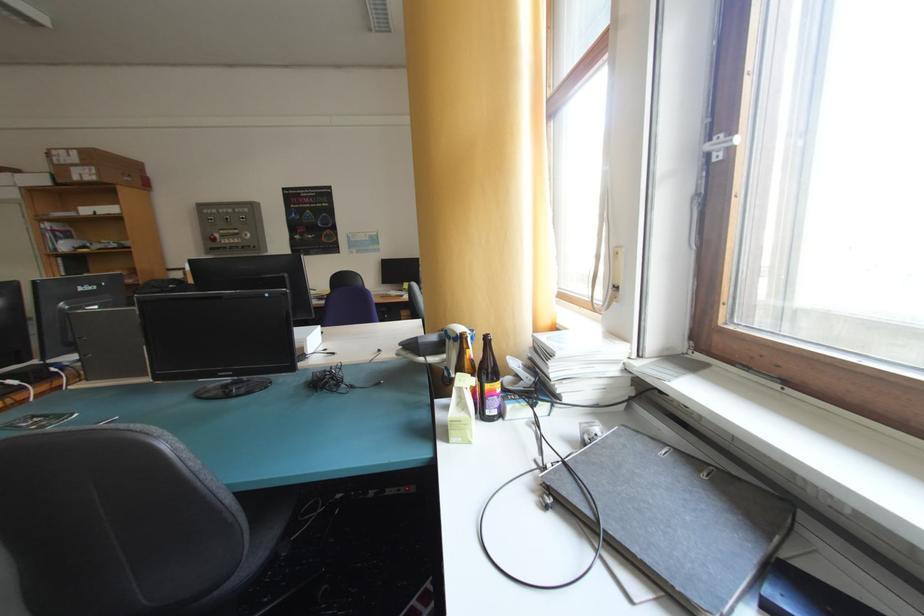
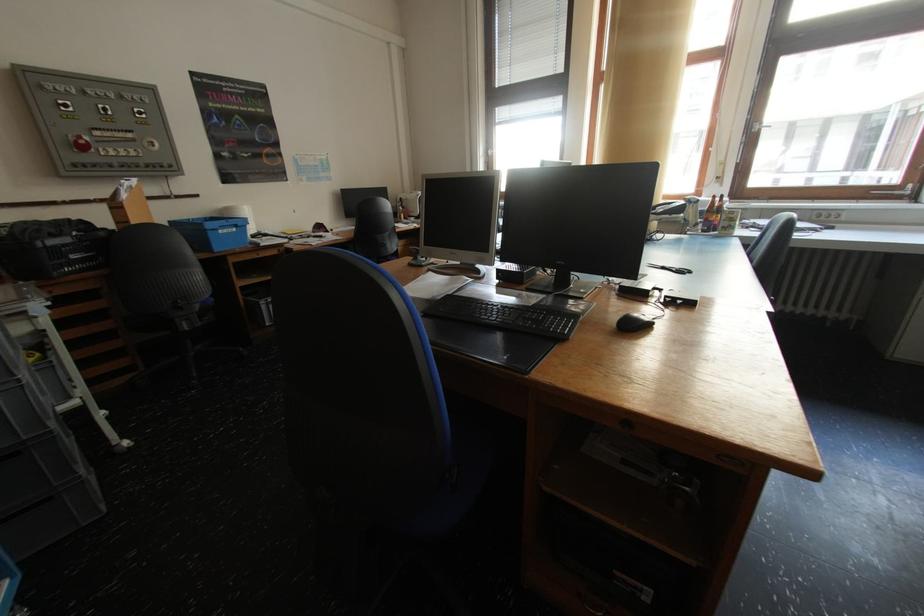
Locate, in the second image, the point that corresponds to point 223,241 in the first image.

(91, 148)